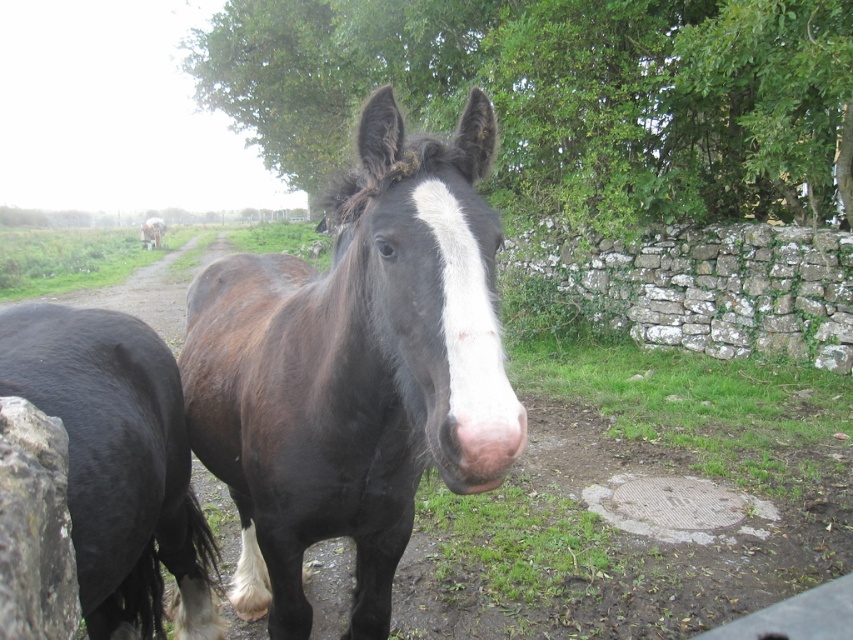
Is black glossy horse at left below weathered stone wall at center-right?

Correct, black glossy horse at left is located below weathered stone wall at center-right.

Does black glossy horse at left appear on the left side of weathered stone wall at center-right?

Indeed, black glossy horse at left is positioned on the left side of weathered stone wall at center-right.

Which is behind, point (115, 616) or point (769, 262)?

The point (769, 262) is more distant.

I want to click on black glossy horse at left, so click(119, 465).

Is shiny brown horse at center above weathered stone wall at center-right?

Incorrect, shiny brown horse at center is not positioned above weathered stone wall at center-right.

The width and height of the screenshot is (853, 640). What do you see at coordinates (355, 369) in the screenshot? I see `shiny brown horse at center` at bounding box center [355, 369].

Locate an element on the screen. shiny brown horse at center is located at coordinates (355, 369).

Is point (844, 296) positioned behind point (155, 246)?

No.

Is weathered stone wall at center-right closer to the viewer compared to white glossy donkey at center?

Yes, weathered stone wall at center-right is closer to the viewer.

Between point (706, 280) and point (160, 227), which one is positioned in front?

Point (706, 280) is in front.

You are a GUI agent. You are given a task and a screenshot of the screen. Output one action in this format:
    pyautogui.click(x=<x>, y=<y>)
    Task: Click on the weathered stone wall at center-right
    This screenshot has width=853, height=640.
    Given the screenshot: What is the action you would take?
    pyautogui.click(x=706, y=285)